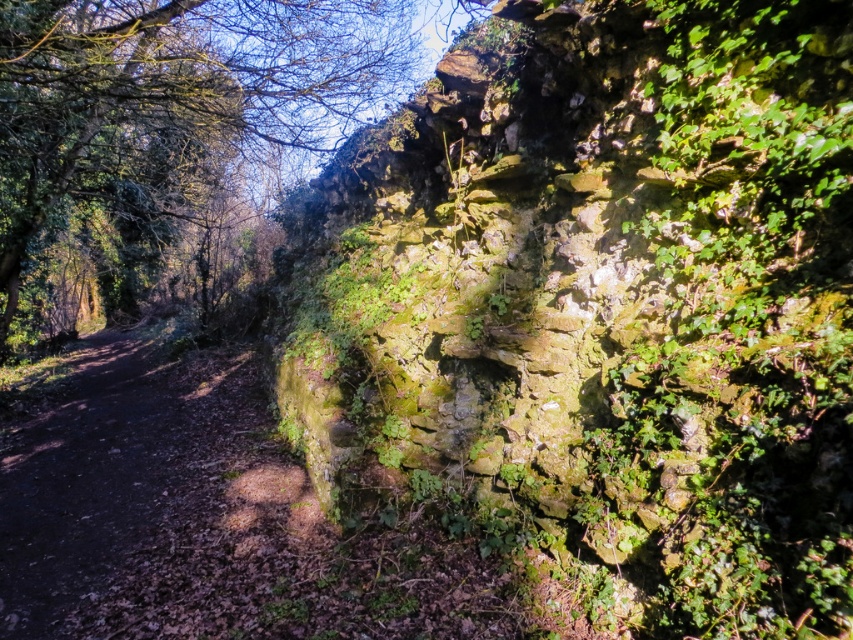
Question: Does green mossy stone wall at upper right have a smaller size compared to green mossy wall at upper center?

Choices:
 (A) yes
 (B) no

Answer: (A)

Question: Which point is farther from the camera taking this photo?

Choices:
 (A) (380, 67)
 (B) (473, 76)

Answer: (A)

Question: Which point appears farthest from the camera in this image?

Choices:
 (A) (705, 556)
 (B) (276, 180)

Answer: (B)

Question: Can you confirm if green mossy stone wall at upper right is positioned to the left of green mossy wall at upper center?

Choices:
 (A) no
 (B) yes

Answer: (A)

Question: Is green mossy stone wall at upper right bigger than green mossy wall at upper center?

Choices:
 (A) no
 (B) yes

Answer: (A)

Question: Which object appears farthest from the camera in this image?

Choices:
 (A) green mossy wall at upper center
 (B) green mossy stone wall at upper right

Answer: (A)